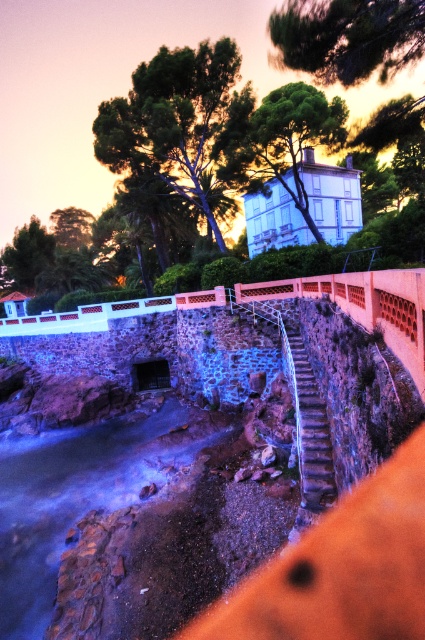
Which is behind, point (36, 531) or point (311, 483)?

The point (36, 531) is more distant.

Locate an element on the screen. translucent glass water at lower left is located at coordinates (79, 496).

Who is more distant from viewer, (152, 465) or (37, 218)?

Positioned behind is point (37, 218).

Locate an element on the screen. This screenshot has height=640, width=425. translucent glass water at lower left is located at coordinates (79, 496).

Does green leafy tree at upper center have a greater width compared to metallic silver stairs at center?

Yes.

Is point (226, 68) farther from viewer compared to point (294, 371)?

That is True.

Does point (107, 100) lie in front of point (309, 509)?

No.

Locate an element on the screen. This screenshot has width=425, height=640. green leafy tree at upper center is located at coordinates (172, 129).